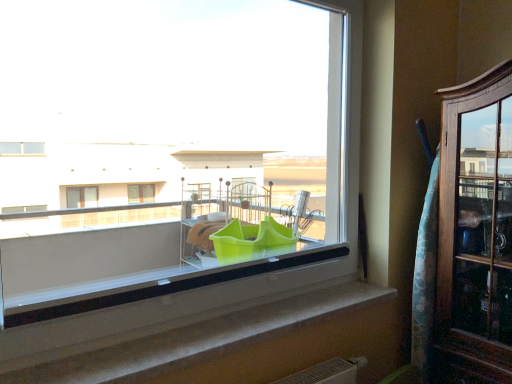
Image resolution: width=512 pixels, height=384 pixels. Identify the location of free space underneath green plastic container at center (from a real-world perspective). (261, 309).